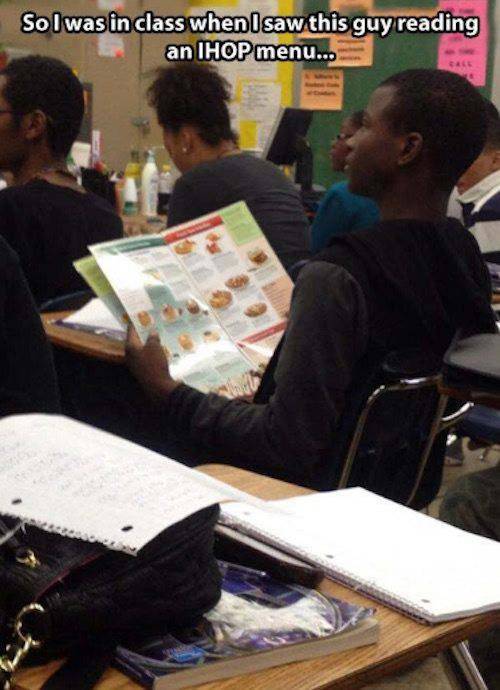
Find the location of `blackboard`. blackboard is located at coordinates (390, 55).